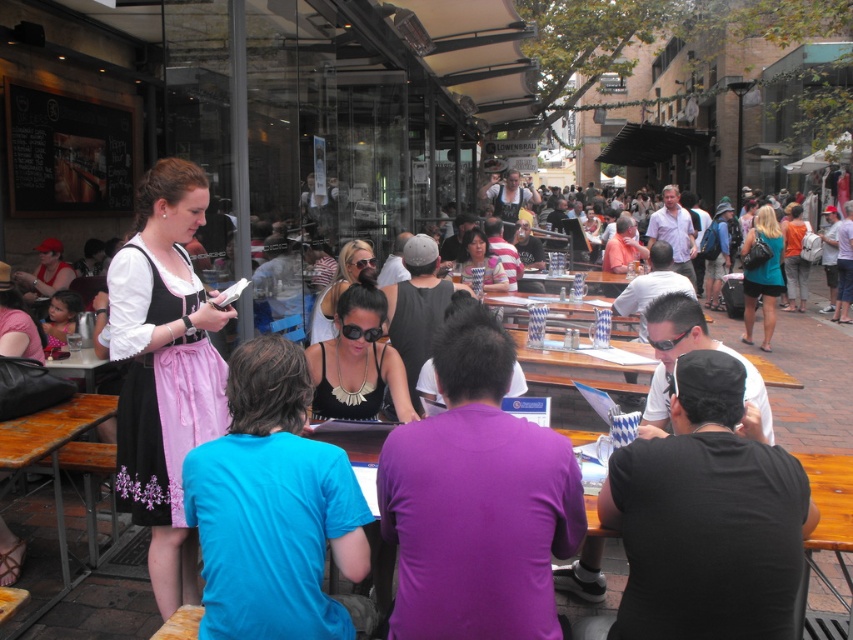
You are a photographer trying to capture a photo of the wooden table at center without including the black matte shirt at lower right in the frame. Based on their heights, is this possible?

The black matte shirt at lower right is taller than wooden table at center, so it would block the view of the wooden table at center. Therefore, it is not possible to capture the wooden table at center without including the black matte shirt at lower right in the frame.

You are a photographer standing at the edge of the outdoor cafe. You notice the blue cotton shirt at center and the wooden table at center. Which object is covering the other one?

The blue cotton shirt at center is positioned over the wooden table at center, so it is covering the wooden table at center.